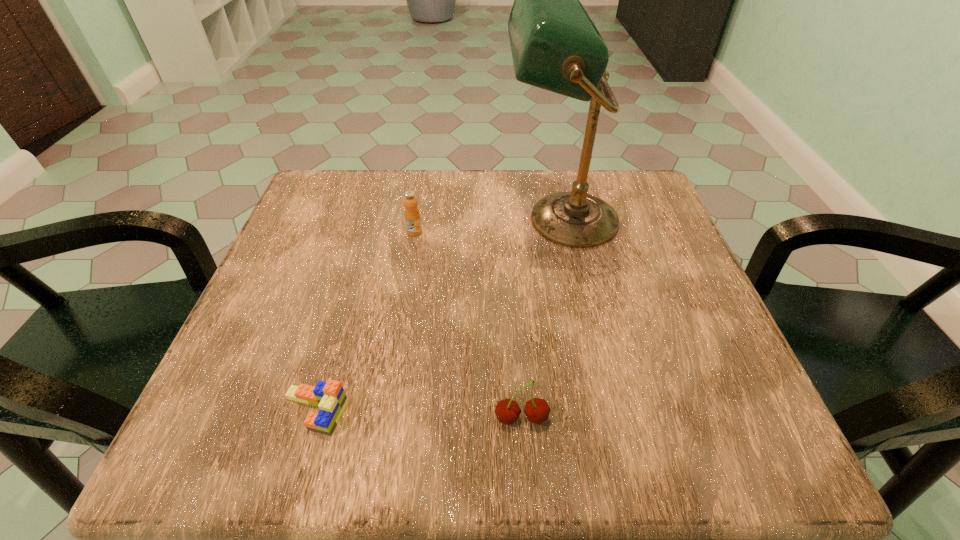
What are the coordinates of `vacant region that satisfies the following two spatial constraints: 1. above the green lampshade of the tallest object; 2. on the surface of the cherry` in the screenshot? It's located at (602, 418).

Where is `free space that satisfies the following two spatial constraints: 1. above the green lampshade of the tallest object; 2. on the front side of the Lego`? This screenshot has width=960, height=540. free space that satisfies the following two spatial constraints: 1. above the green lampshade of the tallest object; 2. on the front side of the Lego is located at coordinates (600, 411).